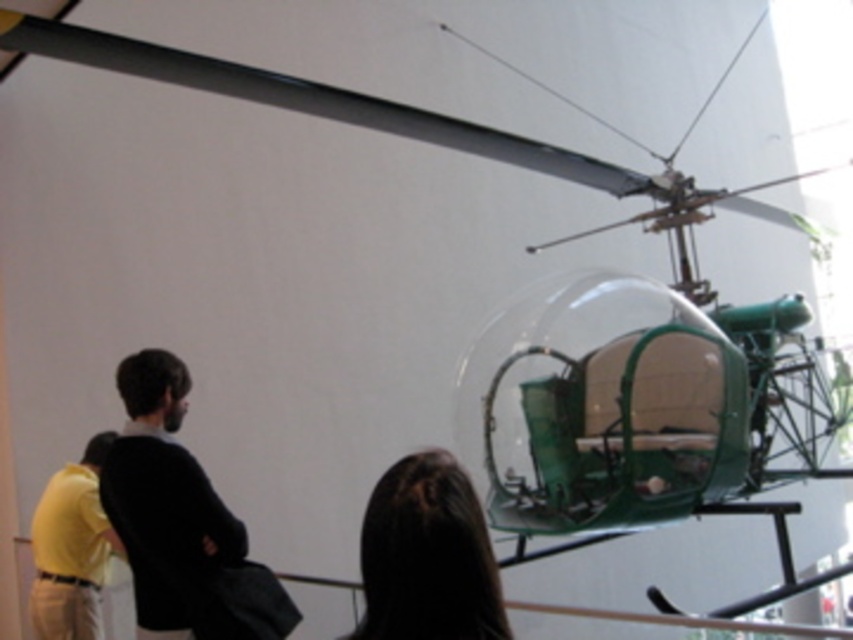
You are a GUI agent. You are given a task and a screenshot of the screen. Output one action in this format:
    pyautogui.click(x=<x>, y=<y>)
    Task: Click on the dark brown leather jacket at left
    The height and width of the screenshot is (640, 853).
    Given the screenshot: What is the action you would take?
    pyautogui.click(x=180, y=522)

Is dark brown leather jacket at left wider than dark brown hair at center?

Yes.

The image size is (853, 640). What do you see at coordinates (180, 522) in the screenshot?
I see `dark brown leather jacket at left` at bounding box center [180, 522].

I want to click on dark brown leather jacket at left, so click(180, 522).

Can you confirm if dark brown hair at center is positioned to the left of yellow matte shirt at lower left?

In fact, dark brown hair at center is to the right of yellow matte shirt at lower left.

Between dark brown hair at center and yellow matte shirt at lower left, which one has more height?

Standing taller between the two is yellow matte shirt at lower left.

This screenshot has height=640, width=853. Describe the element at coordinates (427, 556) in the screenshot. I see `dark brown hair at center` at that location.

At what (x,y) coordinates should I click in order to perform the action: click on dark brown hair at center. Please return your answer as a coordinate pair (x, y). Looking at the image, I should click on (427, 556).

Is dark brown leather jacket at left closer to camera compared to yellow matte shirt at lower left?

Yes, dark brown leather jacket at left is in front of yellow matte shirt at lower left.

Is point (120, 445) more distant than point (70, 506)?

No, (120, 445) is closer to viewer.

At what (x,y) coordinates should I click in order to perform the action: click on dark brown leather jacket at left. Please return your answer as a coordinate pair (x, y). The width and height of the screenshot is (853, 640). Looking at the image, I should click on (180, 522).